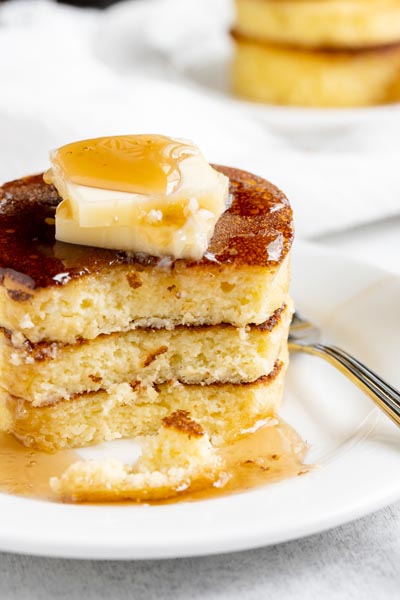
Identify the location of plate. (323, 494).